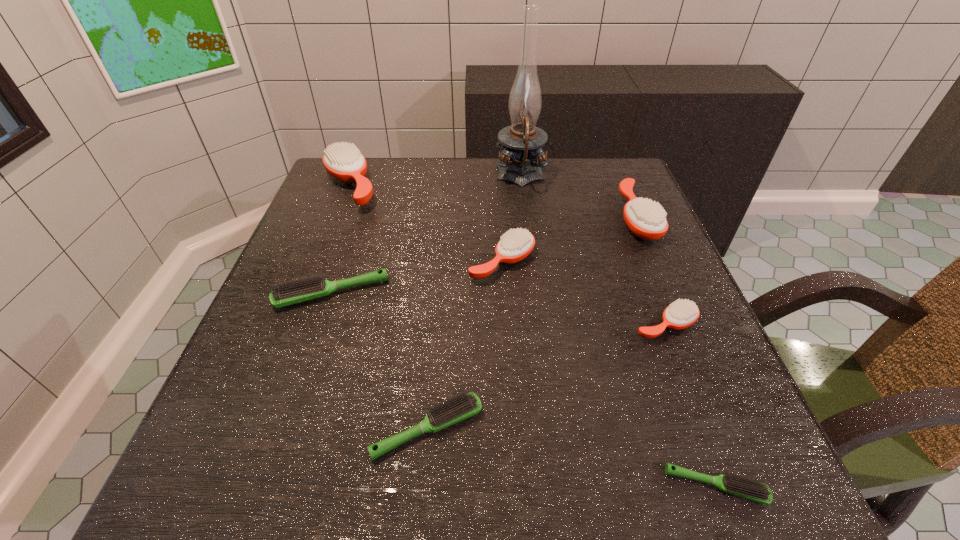
Where is `the second nearest object`? This screenshot has height=540, width=960. the second nearest object is located at coordinates (464, 406).

Locate an element on the screen. The height and width of the screenshot is (540, 960). the second light hairbrush from left to right is located at coordinates (464, 406).

Locate an element on the screen. the nearest light hairbrush is located at coordinates (749, 488).

The image size is (960, 540). I want to click on the smallest light hairbrush, so click(749, 488).

Image resolution: width=960 pixels, height=540 pixels. In order to click on vacant point located 0.340m on the left of the oil lamp in this screenshot , I will do click(x=372, y=177).

Where is `vacant space located on the front of the leftmost orange hairbrush`? Image resolution: width=960 pixels, height=540 pixels. vacant space located on the front of the leftmost orange hairbrush is located at coordinates pos(316,274).

The image size is (960, 540). I want to click on free space located 0.240m on the front of the third smallest orange hairbrush, so click(685, 332).

Where is `free space located on the back of the fourth tallest object`? Image resolution: width=960 pixels, height=540 pixels. free space located on the back of the fourth tallest object is located at coordinates (497, 165).

Locate an element on the screen. vacant space situated on the back of the biggest light hairbrush is located at coordinates (365, 194).

This screenshot has width=960, height=540. I want to click on vacant space situated 0.070m on the back of the nearest orange hairbrush, so click(x=649, y=283).